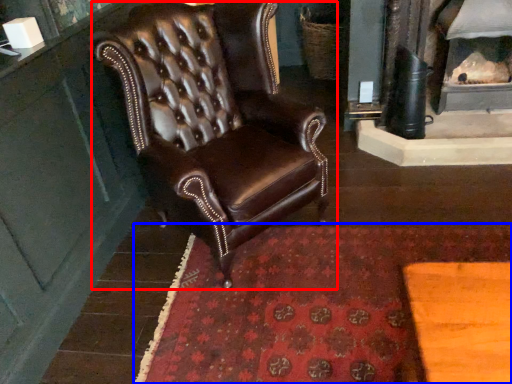
Question: Which of the following is the closest to the observer, chair (highlighted by a red box) or mat (highlighted by a blue box)?

Choices:
 (A) chair
 (B) mat

Answer: (A)